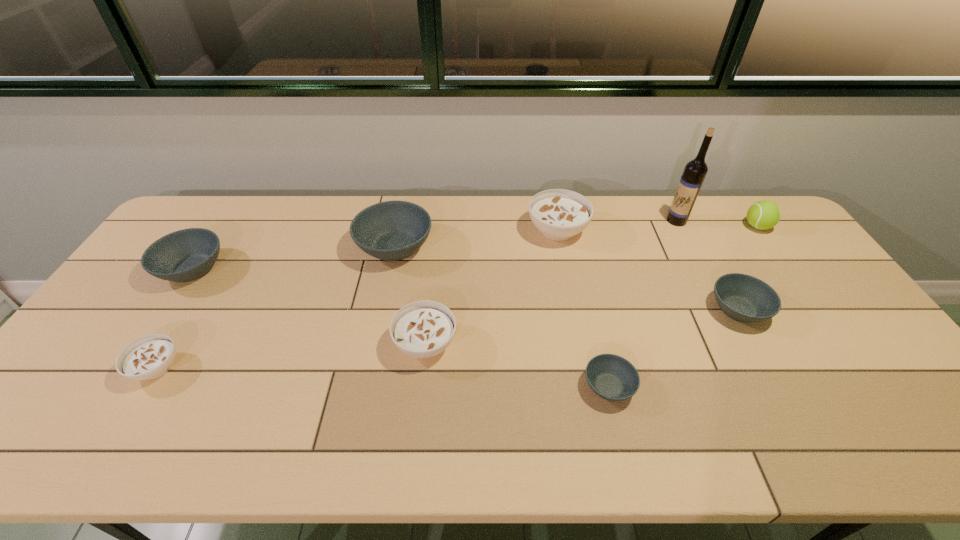
This screenshot has height=540, width=960. In order to click on vacant space at the far edge of the desktop in this screenshot , I will do `click(511, 199)`.

This screenshot has width=960, height=540. Find the location of `free space at the near edge of the desktop`. free space at the near edge of the desktop is located at coordinates (649, 458).

This screenshot has height=540, width=960. In order to click on free space at the right edge of the desktop in this screenshot , I will do [788, 241].

This screenshot has width=960, height=540. In order to click on vacant space at the near left corner of the desktop in this screenshot , I will do `click(45, 443)`.

In the image, there is a desktop. Where is `blank space at the far right corner`? blank space at the far right corner is located at coordinates (768, 231).

You are a GUI agent. You are given a task and a screenshot of the screen. Output one action in this format:
    pyautogui.click(x=<x>, y=<y>)
    Task: Click on the free space between the rightmost white soup bowl and the tennis ball
    This screenshot has height=540, width=960.
    Given the screenshot: What is the action you would take?
    pyautogui.click(x=658, y=228)

Find the location of a particular element. The image size is (960, 540). vacant space that's between the second white soup bowl from right to left and the third smallest gray soup bowl is located at coordinates (309, 306).

Where is `vacant space that's between the green tennis ball and the biggest gray soup bowl`? The height and width of the screenshot is (540, 960). vacant space that's between the green tennis ball and the biggest gray soup bowl is located at coordinates (576, 237).

Locate an element on the screen. The width and height of the screenshot is (960, 540). vacant space that is in between the smallest white soup bowl and the biggest white soup bowl is located at coordinates (357, 299).

Find the location of a particular element. This screenshot has width=960, height=540. vacant point located between the second white soup bowl from right to left and the wine bottle is located at coordinates (551, 282).